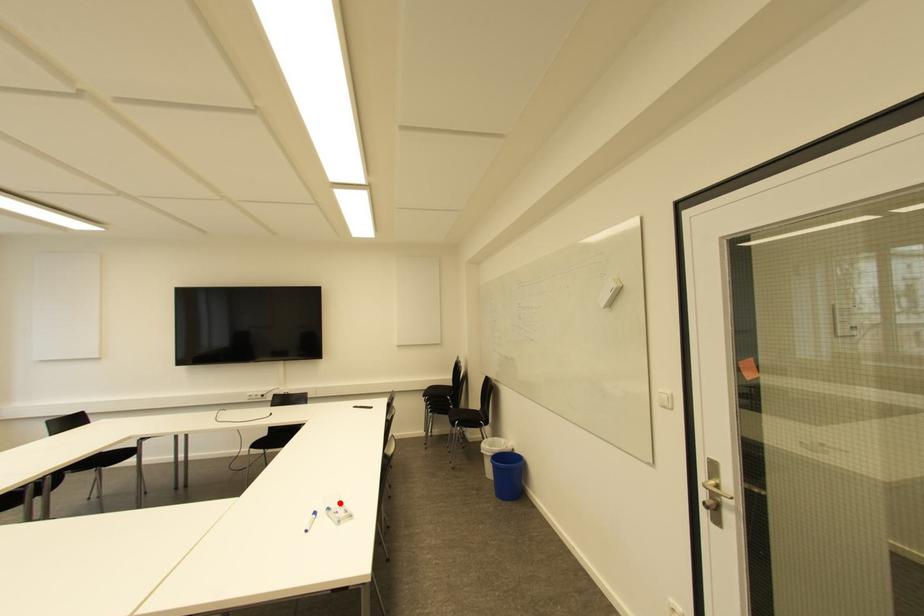
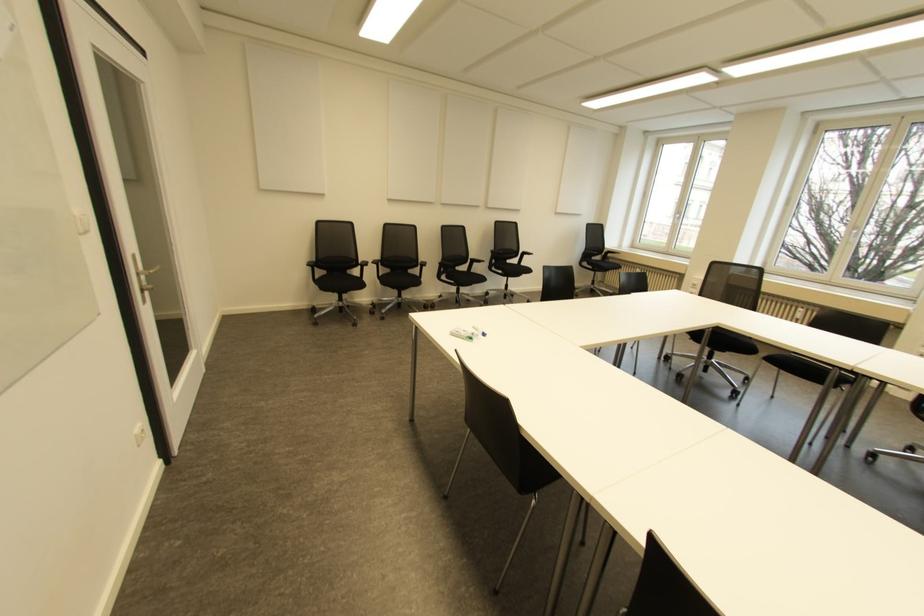
Locate, in the second image, the point that corresponds to the highlighted location in the first image.

(470, 338)